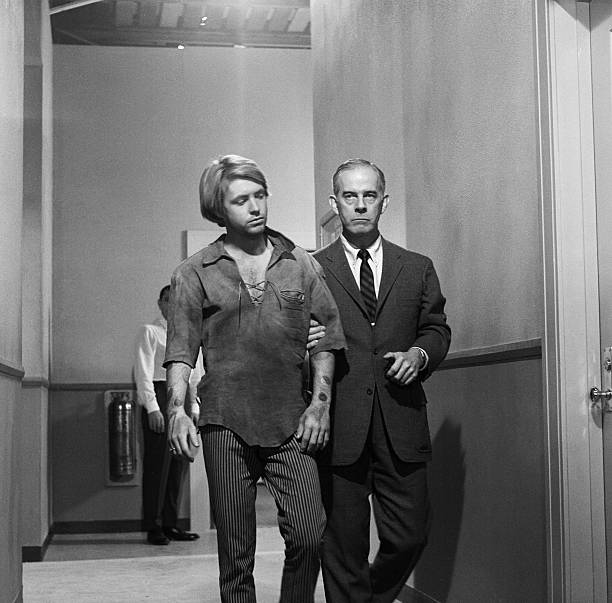
The image size is (612, 603). Identify the location of deadbolt. (606, 365).